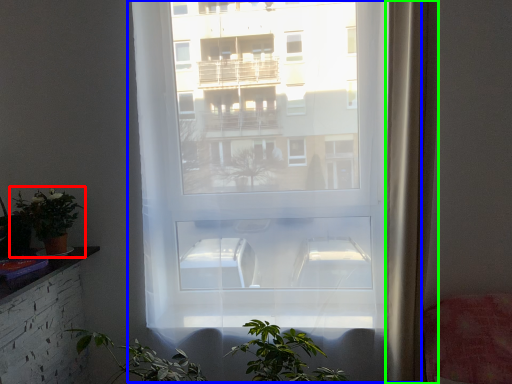
Question: Which object is the farthest from houseplant (highlighted by a red box)? Choose among these: window (highlighted by a blue box) or curtain (highlighted by a green box).

Choices:
 (A) window
 (B) curtain

Answer: (B)